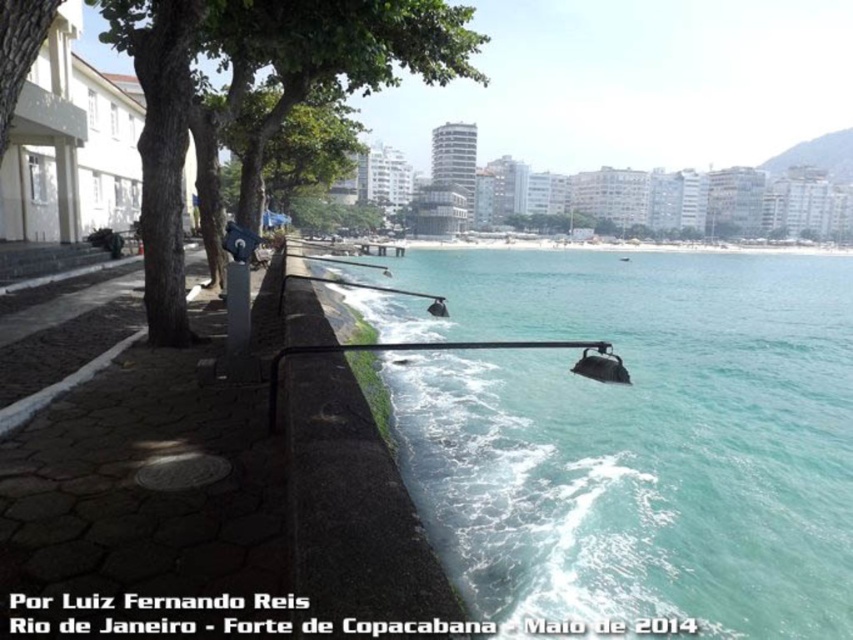
Question: Where is clear blue water at lower center located in relation to green leafy tree at upper center in the image?

Choices:
 (A) below
 (B) above

Answer: (A)

Question: Which point is farther to the camera?

Choices:
 (A) (10, 65)
 (B) (294, 157)
 (C) (281, 120)
 (D) (790, 616)

Answer: (B)

Question: Is clear blue water at lower center closer to the viewer compared to green leafy tree at upper center?

Choices:
 (A) no
 (B) yes

Answer: (B)

Question: Which point is closer to the camera?

Choices:
 (A) green leafy tree at upper left
 (B) green leafy tree at center
 (C) green leafy tree at upper center

Answer: (A)

Question: Is green leafy tree at upper center positioned at the back of green leafy tree at upper left?

Choices:
 (A) yes
 (B) no

Answer: (A)

Question: Which point is closer to the camera?

Choices:
 (A) clear blue water at lower center
 (B) green leafy tree at upper center

Answer: (A)